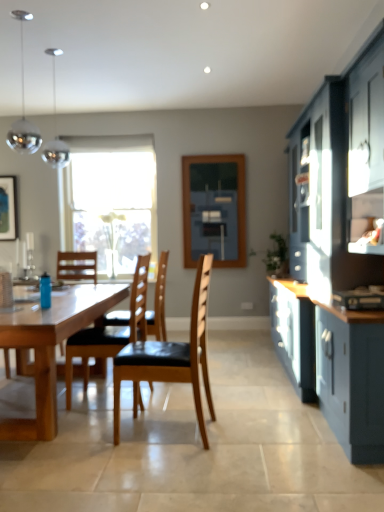
Where is `wooden chair with black seat cushion at center, placed as the second chair when sorted from back to front`? wooden chair with black seat cushion at center, placed as the second chair when sorted from back to front is located at coordinates (110, 331).

What is the approximate height of matte black picture frame at upper left?

matte black picture frame at upper left is 35.06 inches tall.

Identify the location of transparent glass window at center. This screenshot has height=512, width=384. (111, 201).

The height and width of the screenshot is (512, 384). What do you see at coordinates (55, 129) in the screenshot? I see `satin chrome pendant lights at upper left` at bounding box center [55, 129].

What is the approximate width of natural wood table at center?

natural wood table at center is 6.61 feet wide.

The width and height of the screenshot is (384, 512). In order to click on wooden chair with black seat cushion at center, acting as the 2th chair starting from the front in this screenshot , I will do `click(110, 331)`.

Between matte dark blue cabinet at right and matte black picture frame at upper left, which one has smaller width?

matte black picture frame at upper left is thinner.

From a real-world perspective, is matte dark blue cabinet at right below matte black picture frame at upper left?

Yes.

Can we say matte dark blue cabinet at right lies outside matte black picture frame at upper left?

Absolutely, matte dark blue cabinet at right is external to matte black picture frame at upper left.

Is matte dark blue cabinet at right directly adjacent to matte black picture frame at upper left?

No.

Considering the positions of points (113, 317) and (242, 244), is point (113, 317) closer to camera compared to point (242, 244)?

Yes, it is in front of point (242, 244).

From the image's perspective, starting from the blue matte window screen at center, which chair is the 1st one below? Please provide its 2D coordinates.

[(158, 303)]

Can you confirm if wooden chair with black seat cushion at center, the 1th chair from the back, is bigger than blue matte window screen at center?

Indeed, wooden chair with black seat cushion at center, the 1th chair from the back, has a larger size compared to blue matte window screen at center.

Is wooden chair with black seat cushion at center, the 1th chair from the back, placed right next to blue matte window screen at center?

wooden chair with black seat cushion at center, the 1th chair from the back, is not next to blue matte window screen at center, and they're not touching.

Between satin chrome pendant lights at upper left and brown leather chair at center, positioned as the 3th chair in back-to-front order, which one has smaller size?

satin chrome pendant lights at upper left.

Locate an element on the screen. This screenshot has height=512, width=384. the 3rd chair below the satin chrome pendant lights at upper left (from the image's perspective) is located at coordinates (171, 357).

From the image's perspective, which one is positioned higher, satin chrome pendant lights at upper left or brown leather chair at center, positioned as the 3th chair in back-to-front order?

From the image's view, satin chrome pendant lights at upper left is above.

Consider the image. Is satin chrome pendant lights at upper left spatially inside brown leather chair at center, which is the first chair in front-to-back order, or outside of it?

satin chrome pendant lights at upper left is not enclosed by brown leather chair at center, which is the first chair in front-to-back order.

Is natural wood table at center with satin chrome pendant lights at upper left?

No, natural wood table at center is not making contact with satin chrome pendant lights at upper left.

Is the position of natural wood table at center less distant than that of satin chrome pendant lights at upper left?

Yes, it is.

From a real-world perspective, is natural wood table at center located beneath satin chrome pendant lights at upper left?

Yes, from a real-world perspective, natural wood table at center is below satin chrome pendant lights at upper left.

Considering the relative sizes of natural wood table at center and satin chrome pendant lights at upper left in the image provided, is natural wood table at center shorter than satin chrome pendant lights at upper left?

Correct, natural wood table at center is not as tall as satin chrome pendant lights at upper left.

Which point is more forward, (116, 385) or (146, 290)?

The point (116, 385) is closer to the camera.

Can we say brown leather chair at center, which is the first chair in front-to-back order, lies outside wooden chair with black seat cushion at center, placed as the second chair when sorted from back to front?

Yes.

Consider the image. Is brown leather chair at center, which is the first chair in front-to-back order, facing towards wooden chair with black seat cushion at center, placed as the second chair when sorted from back to front?

No, brown leather chair at center, which is the first chair in front-to-back order, is not facing towards wooden chair with black seat cushion at center, placed as the second chair when sorted from back to front.

Is brown leather chair at center, which is the first chair in front-to-back order, thinner than wooden chair with black seat cushion at center, placed as the second chair when sorted from back to front?

Correct, the width of brown leather chair at center, which is the first chair in front-to-back order, is less than that of wooden chair with black seat cushion at center, placed as the second chair when sorted from back to front.

Based on the photo, is matte black picture frame at upper left touching matte dark blue cabinet at right?

They are not placed beside each other.

Is matte black picture frame at upper left wider than matte dark blue cabinet at right?

No, matte black picture frame at upper left is not wider than matte dark blue cabinet at right.

Can you tell me how much matte black picture frame at upper left and matte dark blue cabinet at right differ in facing direction?

matte black picture frame at upper left and matte dark blue cabinet at right are facing 91.8 degrees away from each other.

Find the location of `picture frame above the matte dark blue cabinet at right (from the image's perspective)`. picture frame above the matte dark blue cabinet at right (from the image's perspective) is located at coordinates (8, 208).

Considering the sizes of objects brown leather chair at center, which is the first chair in front-to-back order, and matte dark blue cabinet at right in the image provided, who is smaller, brown leather chair at center, which is the first chair in front-to-back order, or matte dark blue cabinet at right?

With smaller size is brown leather chair at center, which is the first chair in front-to-back order.

Between brown leather chair at center, positioned as the 3th chair in back-to-front order, and matte dark blue cabinet at right, which one is positioned behind?

brown leather chair at center, positioned as the 3th chair in back-to-front order, is further away from the camera.

Is brown leather chair at center, which is the first chair in front-to-back order, at the right side of matte dark blue cabinet at right?

No, brown leather chair at center, which is the first chair in front-to-back order, is not to the right of matte dark blue cabinet at right.

Is brown leather chair at center, positioned as the 3th chair in back-to-front order, facing towards matte dark blue cabinet at right?

No, brown leather chair at center, positioned as the 3th chair in back-to-front order, is not turned towards matte dark blue cabinet at right.

The height and width of the screenshot is (512, 384). In order to click on cabinetry that is below the matte black picture frame at upper left (from the image's perspective) in this screenshot , I will do `click(338, 253)`.

Locate an element on the screen. window screen on the right of wooden chair with black seat cushion at center, which is the third chair in front-to-back order is located at coordinates (214, 209).

Estimate the real-world distances between objects in this image. Which object is further from satin chrome pendant lights at upper left, transparent glass window at center or wooden chair with black seat cushion at center, placed as the second chair when sorted from back to front?

wooden chair with black seat cushion at center, placed as the second chair when sorted from back to front, is further to satin chrome pendant lights at upper left.

Considering their positions, is satin chrome pendant lights at upper left positioned closer to matte black picture frame at upper left than blue matte water bottle at table left?

satin chrome pendant lights at upper left lies closer to matte black picture frame at upper left than the other object.

Based on their spatial positions, is blue matte window screen at center or brown leather chair at center, positioned as the 3th chair in back-to-front order, further from wooden chair with black seat cushion at center, acting as the 2th chair starting from the front?

The object further to wooden chair with black seat cushion at center, acting as the 2th chair starting from the front, is blue matte window screen at center.

From the picture: When comparing their distances from matte black picture frame at upper left, does transparent glass window at center or white plastic power outlet at center seem closer?

transparent glass window at center is positioned closer to the anchor matte black picture frame at upper left.

When comparing their distances from white plastic power outlet at center, does transparent glass window at center or brown leather chair at center, which is the first chair in front-to-back order, seem further?

brown leather chair at center, which is the first chair in front-to-back order, lies further to white plastic power outlet at center than the other object.

Considering their positions, is blue matte window screen at center positioned further to wooden chair with black seat cushion at center, the 1th chair from the back, than matte dark blue cabinet at right?

blue matte window screen at center is further to wooden chair with black seat cushion at center, the 1th chair from the back.

Looking at the image, which one is located closer to satin chrome pendant lights at upper left, natural wood table at center or transparent glass window at center?

Among the two, transparent glass window at center is located nearer to satin chrome pendant lights at upper left.

Estimate the real-world distances between objects in this image. Which object is further from wooden chair with black seat cushion at center, the 1th chair from the back, white plastic power outlet at center or wooden chair with black seat cushion at center, acting as the 2th chair starting from the front?

white plastic power outlet at center is positioned further to the anchor wooden chair with black seat cushion at center, the 1th chair from the back.

The width and height of the screenshot is (384, 512). In order to click on picture frame located between brown leather chair at center, positioned as the 3th chair in back-to-front order, and transparent glass window at center in the depth direction in this screenshot , I will do `click(8, 208)`.

Image resolution: width=384 pixels, height=512 pixels. Identify the location of picture frame between blue matte water bottle at table left and transparent glass window at center along the z-axis. (8, 208).

This screenshot has height=512, width=384. Find the location of `chair between satin chrome pendant lights at upper left and wooden chair with black seat cushion at center, placed as the second chair when sorted from back to front, from top to bottom`. chair between satin chrome pendant lights at upper left and wooden chair with black seat cushion at center, placed as the second chair when sorted from back to front, from top to bottom is located at coordinates (158, 303).

Where is `lamp positioned between wooden chair with black seat cushion at center, the 1th chair from the back, and white plastic power outlet at center from near to far`? lamp positioned between wooden chair with black seat cushion at center, the 1th chair from the back, and white plastic power outlet at center from near to far is located at coordinates (55, 129).